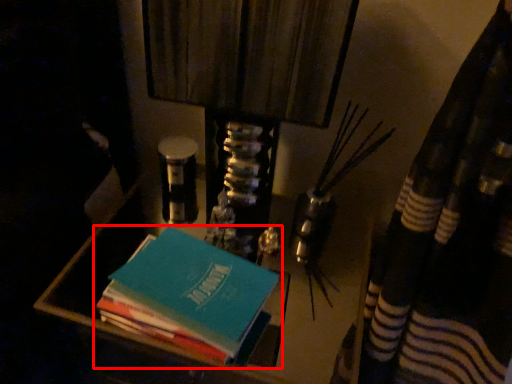
Question: From the image's perspective, what is the correct spatial positioning of book (annotated by the red box) in reference to vanity?

Choices:
 (A) below
 (B) above

Answer: (B)